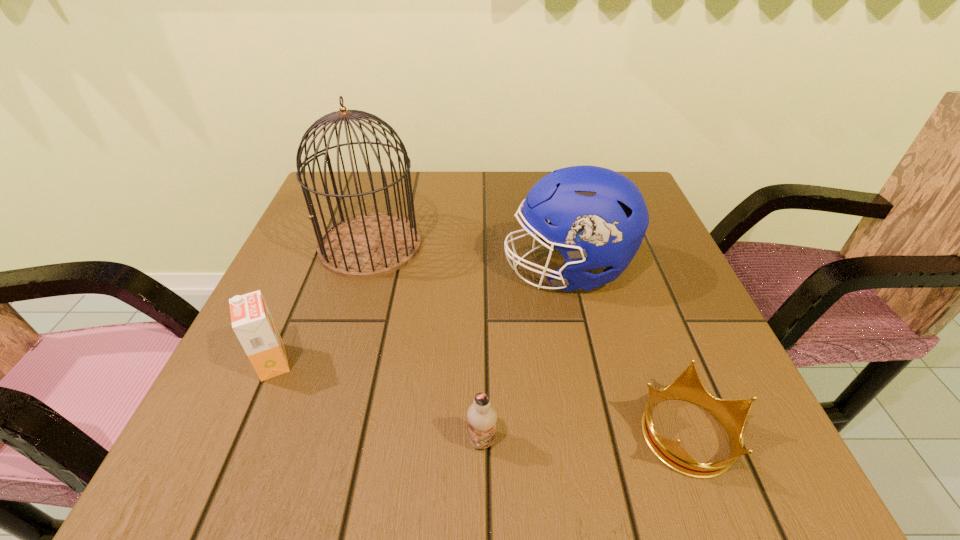
In order to click on birdcage in this screenshot , I will do `click(369, 245)`.

The image size is (960, 540). What are the coordinates of `the second tallest object` in the screenshot? It's located at (597, 218).

Find the location of a particular element. This screenshot has width=960, height=540. orange juice is located at coordinates (252, 322).

In order to click on the third nearest object in this screenshot , I will do `click(252, 322)`.

You are a GUI agent. You are given a task and a screenshot of the screen. Output one action in this format:
    pyautogui.click(x=<x>, y=<y>)
    Task: Click on the third object from right to left
    
    Given the screenshot: What is the action you would take?
    pyautogui.click(x=482, y=417)

In order to click on the fourth tallest object in this screenshot , I will do `click(482, 417)`.

Image resolution: width=960 pixels, height=540 pixels. In order to click on crown in this screenshot , I will do click(x=732, y=414).

You are a GUI agent. You are given a task and a screenshot of the screen. Output one action in this format:
    pyautogui.click(x=<x>, y=<y>)
    Task: Click on the free region located 0.270m at the door of the birdcage
    
    Given the screenshot: What is the action you would take?
    pyautogui.click(x=326, y=392)

Identify the location of free location located 0.080m on the front-facing side of the fourth shortest object. The image size is (960, 540). (466, 270).

This screenshot has height=540, width=960. I want to click on free space located 0.180m on the front-facing side of the fourth shortest object, so click(x=418, y=270).